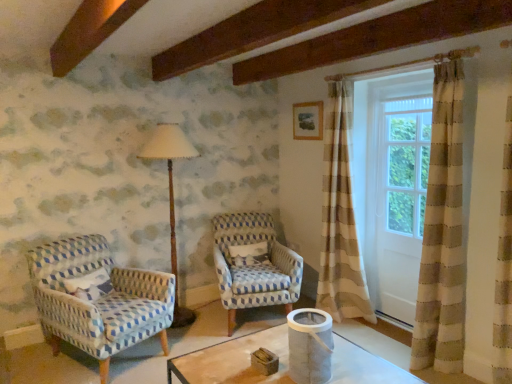
Question: In terms of size, does white wood screen door at right appear bigger or smaller than blue-patterned fabric chair at left, marked as the 1th chair in a left-to-right arrangement?

Choices:
 (A) big
 (B) small

Answer: (B)

Question: In terms of height, does white wood screen door at right look taller or shorter compared to blue-patterned fabric chair at left, marked as the 1th chair in a left-to-right arrangement?

Choices:
 (A) tall
 (B) short

Answer: (A)

Question: Which object is positioned closest to the white textured pillow at center?

Choices:
 (A) blue-patterned fabric chair at left, acting as the 2th chair starting from the right
 (B) wooden picture frame at upper center
 (C) blue and white woven chair at center, which appears as the 2th chair when viewed from the left
 (D) white wood screen door at right
 (E) wooden floor lamp at left

Answer: (C)

Question: Estimate the real-world distances between objects in this image. Which object is closer to the wooden picture frame at upper center?

Choices:
 (A) white textured pillow at center
 (B) blue and white woven chair at center, which appears as the 2th chair when viewed from the left
 (C) white wood screen door at right
 (D) wooden floor lamp at left
 (E) blue-patterned fabric chair at left, acting as the 2th chair starting from the right

Answer: (C)